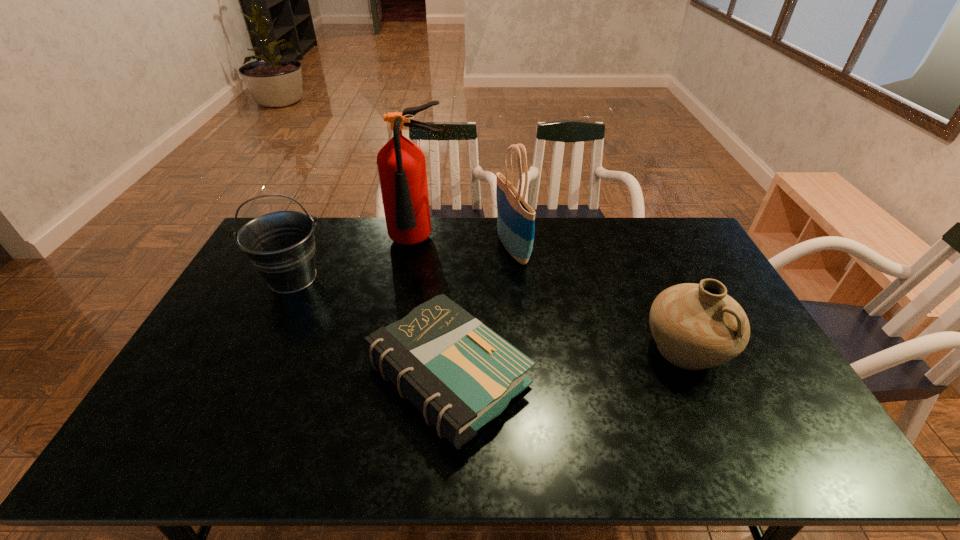
This screenshot has width=960, height=540. Identify the location of the tallest object. point(401,164).

Locate an element on the screen. The height and width of the screenshot is (540, 960). the second tallest object is located at coordinates (515, 218).

Find the location of a particular element. The height and width of the screenshot is (540, 960). the third tallest object is located at coordinates (280, 245).

You are a GUI agent. You are given a task and a screenshot of the screen. Output one action in this format:
    pyautogui.click(x=<x>, y=<y>)
    Task: Click on the bucket
    This screenshot has width=960, height=540.
    Given the screenshot: What is the action you would take?
    pyautogui.click(x=280, y=245)

Identify the location of pottery. (695, 326).

Find the location of a particular element. Image resolution: width=960 pixels, height=540 pixels. the rightmost object is located at coordinates (695, 326).

What are the coordinates of `the shortest object` in the screenshot? It's located at (457, 372).

Identify the location of free space located 0.170m at the nozzle of the tallest object. (408, 297).

You are a GUI agent. You are given a task and a screenshot of the screen. Output one action in this format:
    pyautogui.click(x=<x>, y=<y>)
    Task: Click on the free space located 0.370m on the left of the fourth shortest object
    Image resolution: width=960 pixels, height=540 pixels.
    Given the screenshot: What is the action you would take?
    pyautogui.click(x=395, y=248)

Locate an element on the screen. This screenshot has width=960, height=540. vacant point located on the right of the third shortest object is located at coordinates (382, 278).